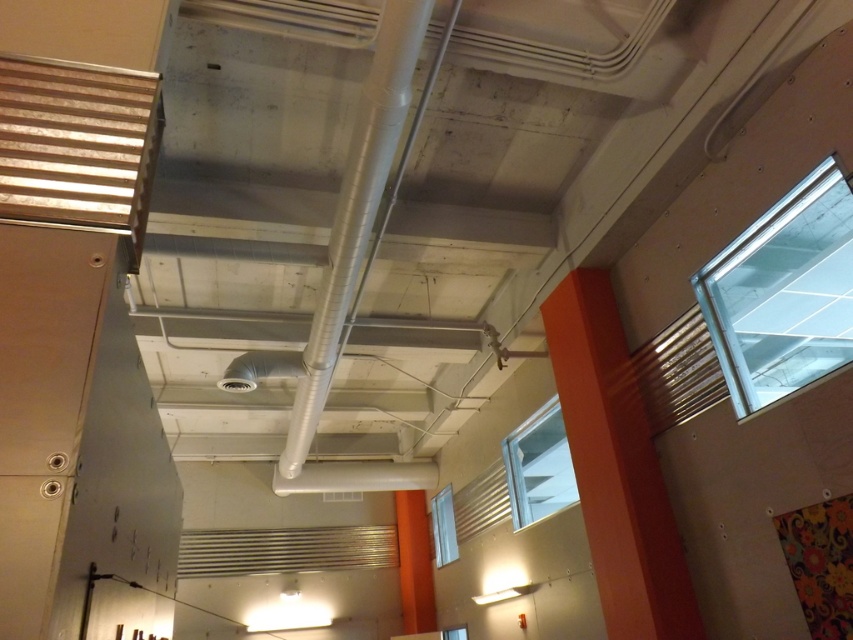
You are an interior designer planning to install a light fixture between the orange matte pillar at center and the silver metallic pipe at center. Based on their positions, which object should the light fixture be closer to if it needs to be centered between them?

The light fixture should be centered between the orange matte pillar at center and the silver metallic pipe at center. Since the orange matte pillar at center is to the right of the silver metallic pipe at center, the light fixture should be placed equidistant between both objects, maintaining symmetry in the design.

You are a painter who needs to place a ladder between the orange matte pillar at center and the silver metallic pipe at center. The ladder is 6 feet long. Can you safely place the ladder between them without it touching either object?

The orange matte pillar at center and silver metallic pipe at center are 6.48 feet apart from each other. Since the ladder is 6 feet long, there is enough space to place it between them safely without touching either object.